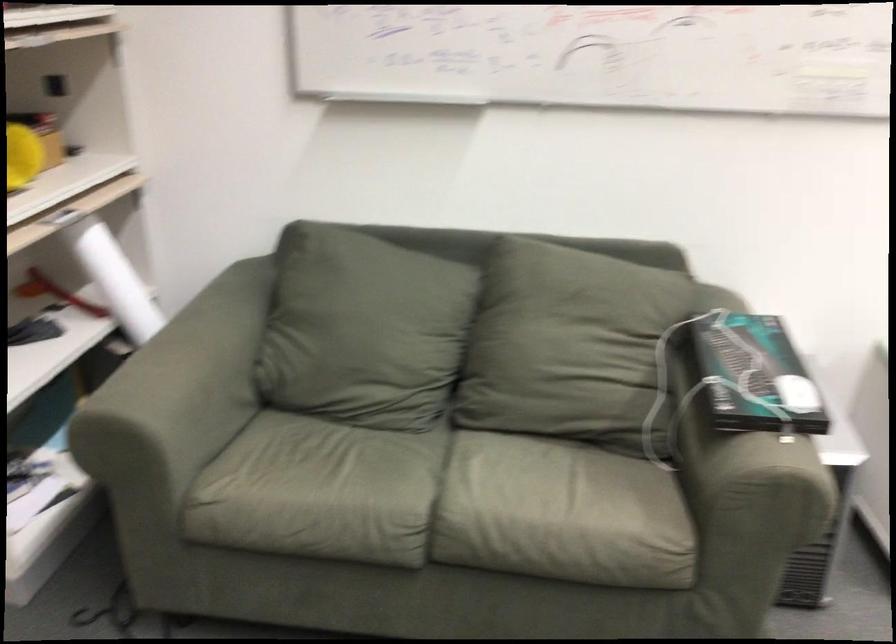
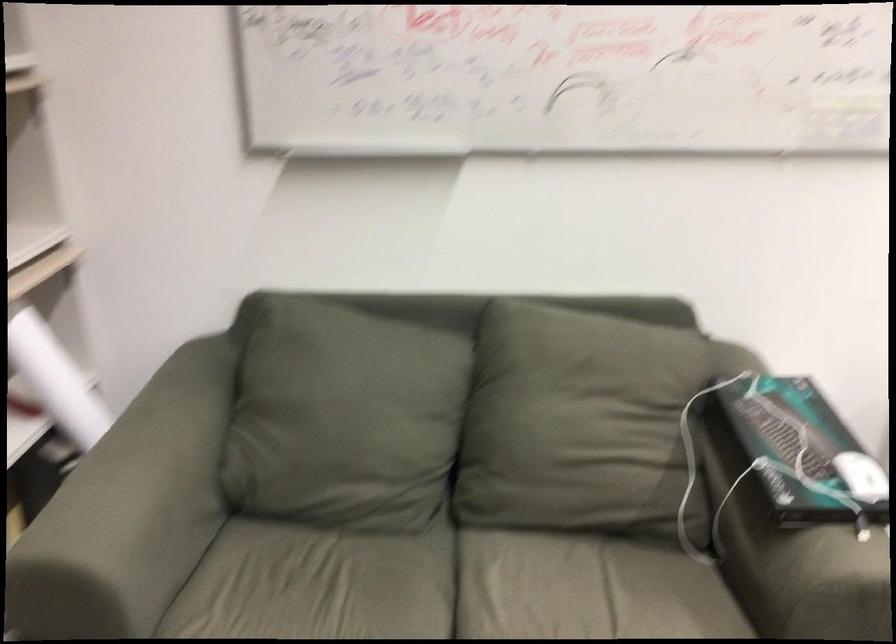
Question: How did the camera likely rotate?

Choices:
 (A) Left
 (B) Right
 (C) Up
 (D) Down

Answer: (B)